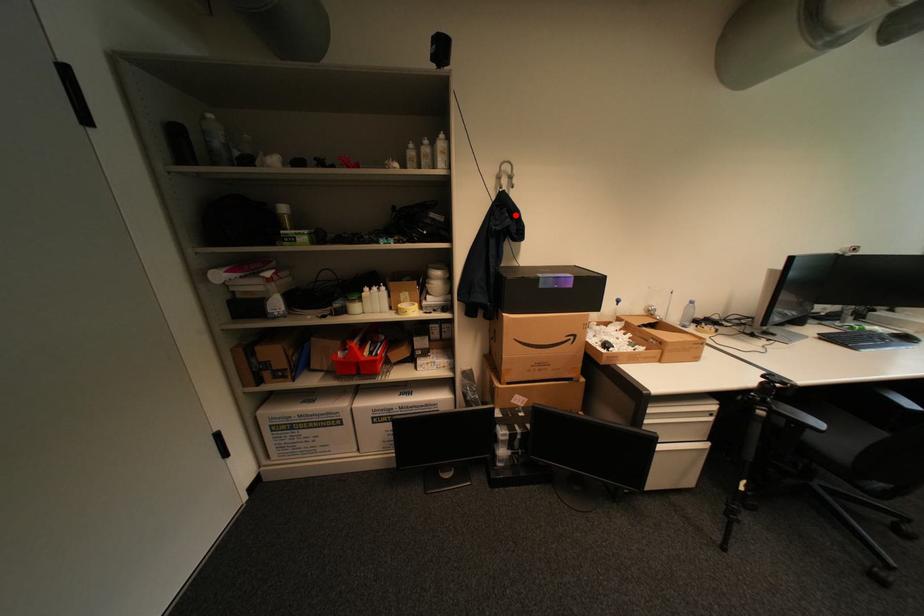
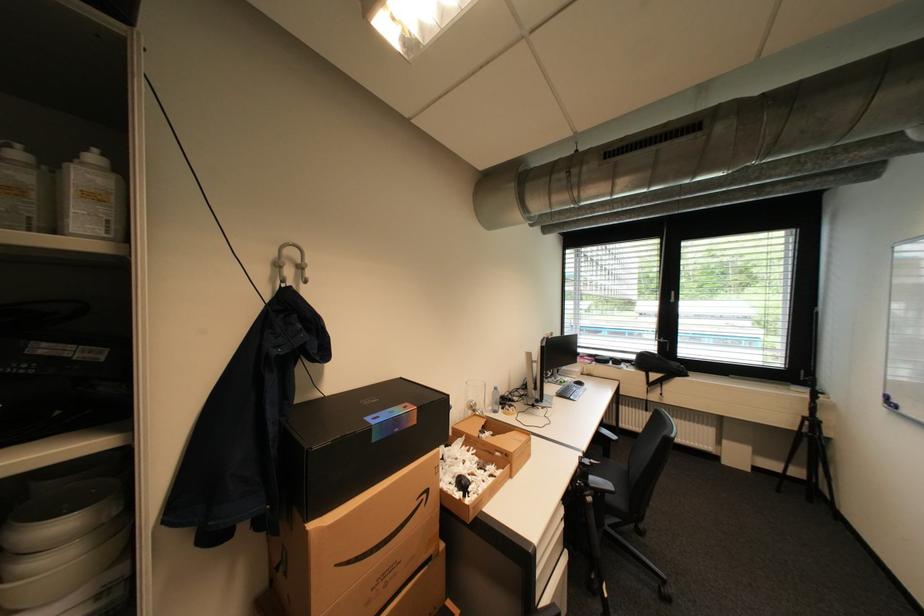
Locate, in the second image, the point that corresponds to the highlighted location in the first image.

(309, 326)